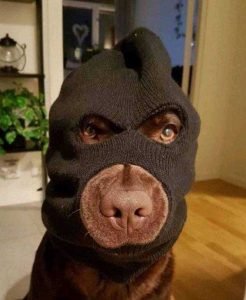
This screenshot has width=246, height=300. Identify the location of wall. (217, 114).